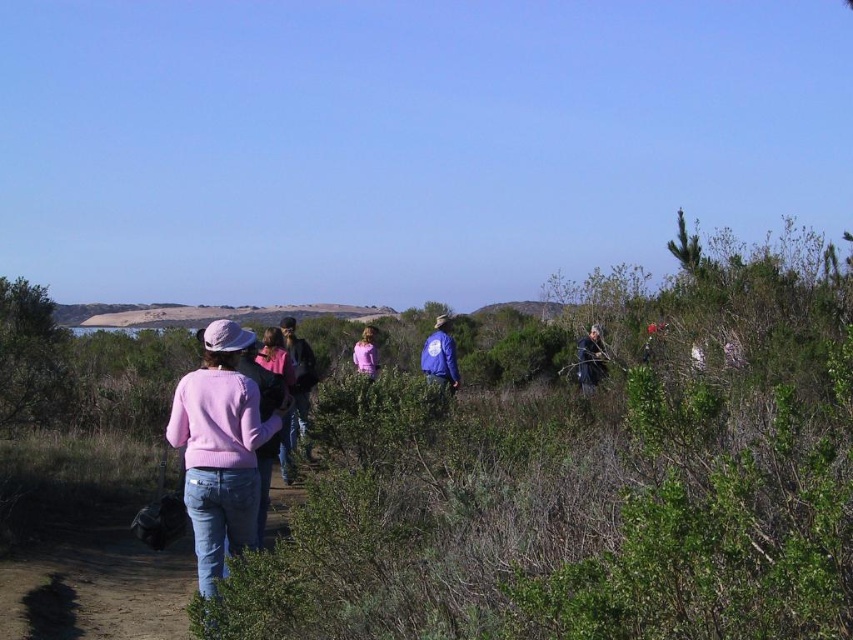
You are standing at the point marked by the coordinate point at (579, 381). You want to walk to the other side of the dense vegetation. The dense vegetation is 58.69 feet away from you. If your walking speed is 3 feet per second, how many seconds will it take you to reach the other side?

It will take approximately 19.56 seconds to reach the other side of the dense vegetation since the distance is 58.69 feet and you walk at 3 feet per second. 58.69 divided by 3 equals approximately 19.56 seconds.